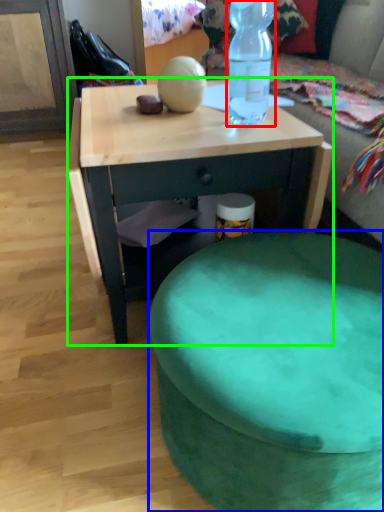
Question: Which object is the closest to the bottle (highlighted by a red box)? Choose among these: stool (highlighted by a blue box) or desk (highlighted by a green box).

Choices:
 (A) stool
 (B) desk

Answer: (B)